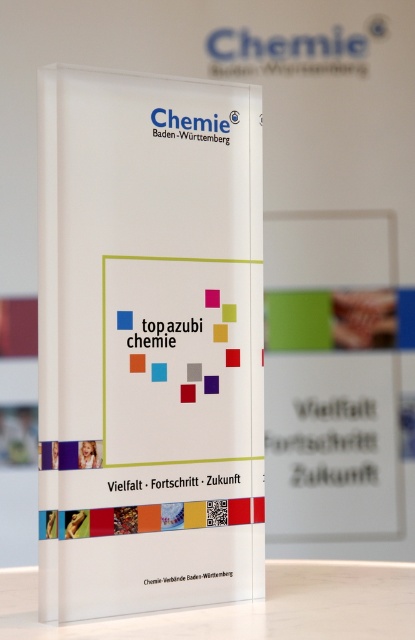
You are organizing a chemistry fair and need to place a 15 cm tall model of a molecule on the transparent acrylic table at lower center. The white glossy sign at center has a message that needs to be visible to attendees. Will placing the model on the table block the view of the sign?

The white glossy sign at center is larger in size than the transparent acrylic table at lower center. Since the table is smaller, placing the 15 cm tall model on it won

From the picture: You are a visitor at a career fair and want to read the information on the white glossy sign at center displayed on the transparent acrylic table at lower center. Can you comfortably read the text from where you are standing?

The distance between the white glossy sign at center and the transparent acrylic table at lower center is 15.79 centimeters. Since the sign is placed close to the table, you might have difficulty reading the text comfortably from a standing position unless you lean in closely.